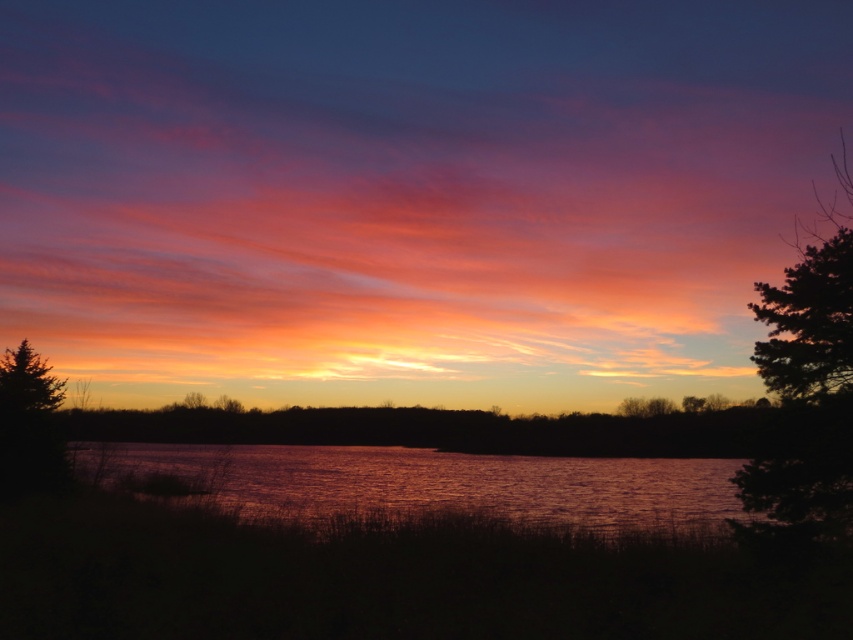
Is silhouette tree at right taller than green textured tree at right?

Indeed, silhouette tree at right has a greater height compared to green textured tree at right.

Looking at this image, which of these two, silhouette tree at right or green textured tree at right, stands taller?

Standing taller between the two is silhouette tree at right.

Measure the distance between point (747,484) and camera.

17.96 meters

I want to click on silhouette tree at right, so click(805, 392).

Between silhouette tree at right and green matte tree at left, which one appears on the left side from the viewer's perspective?

From the viewer's perspective, green matte tree at left appears more on the left side.

At what (x,y) coordinates should I click in order to perform the action: click on silhouette tree at right. Please return your answer as a coordinate pair (x, y). The image size is (853, 640). Looking at the image, I should click on (805, 392).

Does point (844, 387) come behind point (36, 376)?

No, it is in front of (36, 376).

Locate an element on the screen. Image resolution: width=853 pixels, height=640 pixels. silhouette tree at right is located at coordinates (805, 392).

Does point (804, 355) lie behind point (10, 392)?

No, it is not.

Is green textured tree at right above green matte tree at left?

Yes.

Is point (799, 266) closer to camera compared to point (9, 387)?

Yes, point (799, 266) is closer to viewer.

Locate an element on the screen. The width and height of the screenshot is (853, 640). green textured tree at right is located at coordinates (808, 323).